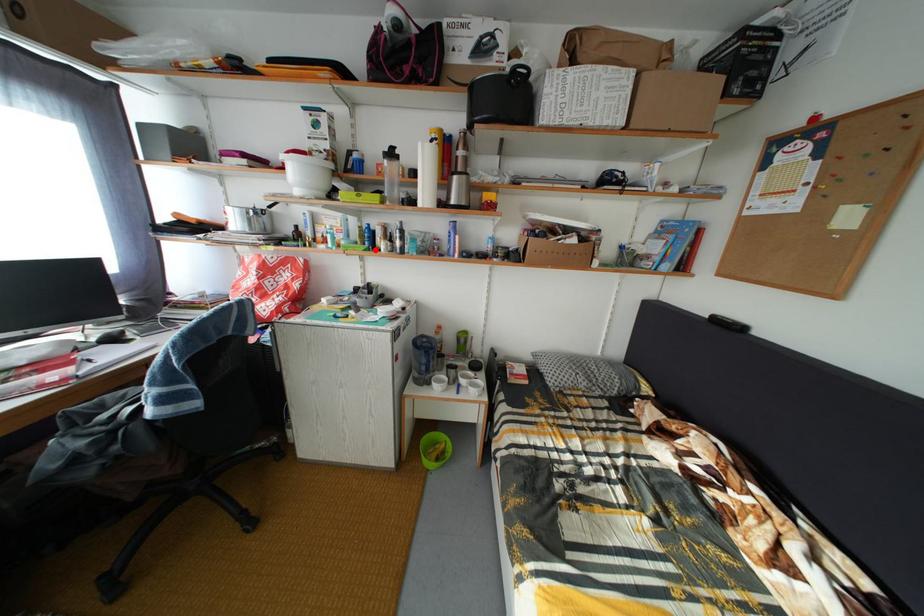
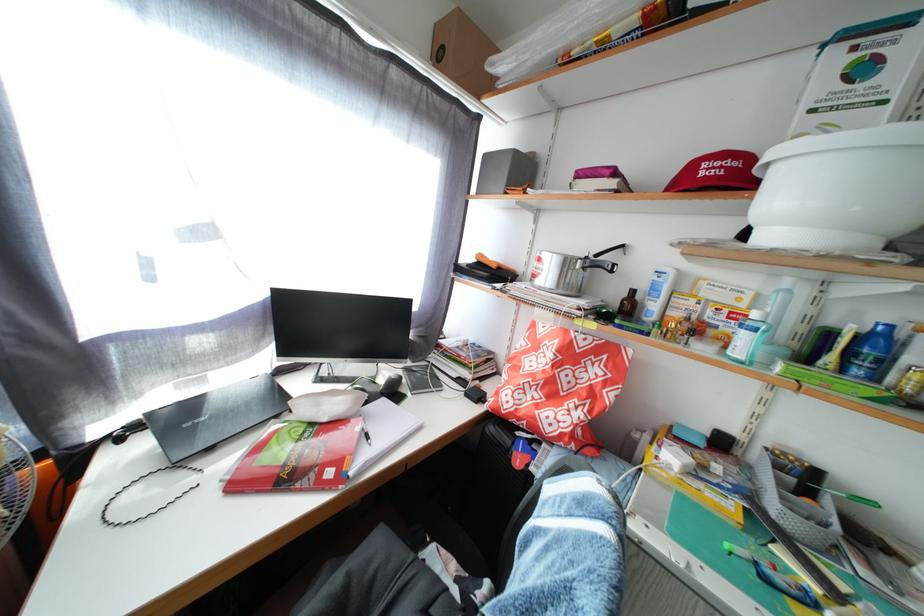
Where in the second image is the point corresponding to the highlighted location from the first image?

(866, 378)